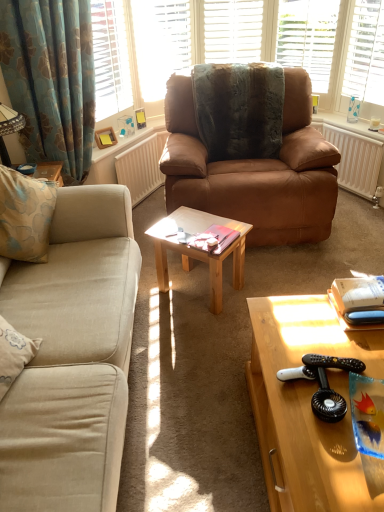
Where is `vacant space situated above matte pink book at center (from a real-world perspective)`? This screenshot has height=512, width=384. vacant space situated above matte pink book at center (from a real-world perspective) is located at coordinates (218, 234).